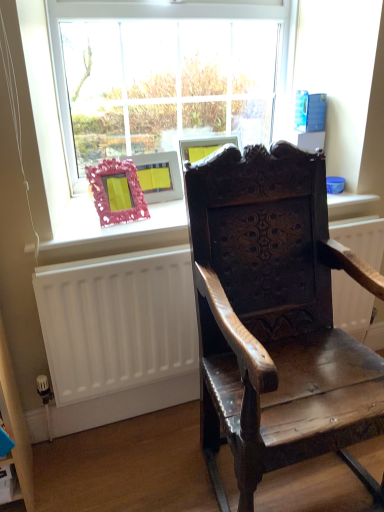
Identify the location of vacant space underneath dark wood carved chair at center (from a real-world perspective). The height and width of the screenshot is (512, 384). (309, 484).